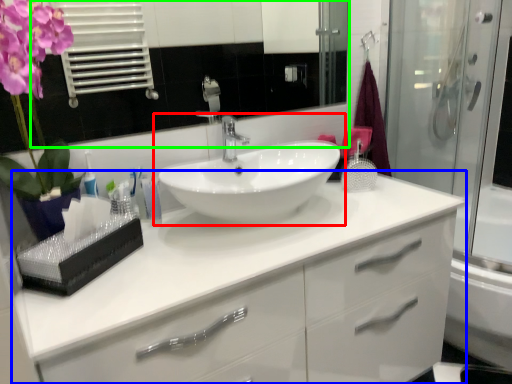
Question: Estimate the real-world distances between objects in this image. Which object is closer to sink (highlighted by a red box), bathroom cabinet (highlighted by a blue box) or mirror (highlighted by a green box)?

Choices:
 (A) bathroom cabinet
 (B) mirror

Answer: (A)